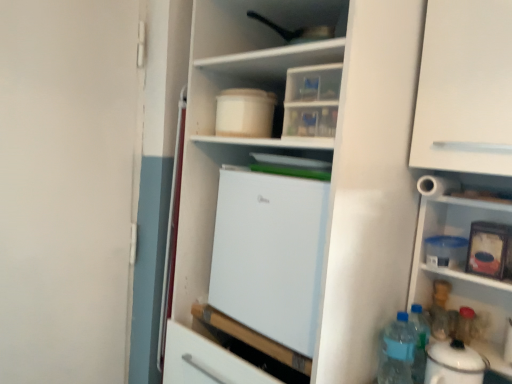
Question: Would you say white glossy electric kettle at lower right contains white matte cabinet at upper right?

Choices:
 (A) no
 (B) yes

Answer: (A)

Question: From a real-world perspective, is white glossy electric kettle at lower right under white matte cabinet at upper right?

Choices:
 (A) no
 (B) yes

Answer: (B)

Question: Is white glossy electric kettle at lower right not near white matte cabinet at upper right?

Choices:
 (A) yes
 (B) no

Answer: (B)

Question: Can you confirm if white glossy electric kettle at lower right is wider than white matte cabinet at upper right?

Choices:
 (A) yes
 (B) no

Answer: (B)

Question: Is white glossy electric kettle at lower right in front of white matte cabinet at upper right?

Choices:
 (A) yes
 (B) no

Answer: (B)

Question: Relative to blue plastic bottle at lower right, the first bottle viewed from the back, is white glossy electric kettle at lower right in front or behind?

Choices:
 (A) behind
 (B) front

Answer: (B)

Question: From their relative heights in the image, would you say white glossy electric kettle at lower right is taller or shorter than blue plastic bottle at lower right, the first bottle viewed from the back?

Choices:
 (A) tall
 (B) short

Answer: (A)

Question: From the image's perspective, is white glossy electric kettle at lower right located above or below blue plastic bottle at lower right, the second bottle when ordered from left to right?

Choices:
 (A) above
 (B) below

Answer: (B)

Question: From a real-world perspective, is white glossy electric kettle at lower right physically located above or below blue plastic bottle at lower right, which is the 2th bottle from right to left?

Choices:
 (A) above
 (B) below

Answer: (B)

Question: Is white matte refrigerator at center inside or outside of blue plastic bottle at lower right, which is the 2th bottle from right to left?

Choices:
 (A) outside
 (B) inside

Answer: (A)

Question: From a real-world perspective, is white matte refrigerator at center physically located above or below blue plastic bottle at lower right, the first bottle viewed from the back?

Choices:
 (A) below
 (B) above

Answer: (B)

Question: Looking at their shapes, would you say white matte refrigerator at center is wider or thinner than blue plastic bottle at lower right, the first bottle viewed from the back?

Choices:
 (A) wide
 (B) thin

Answer: (A)

Question: In the image, is white matte refrigerator at center positioned in front of or behind blue plastic bottle at lower right, the first bottle viewed from the back?

Choices:
 (A) front
 (B) behind

Answer: (A)

Question: Considering the positions of white matte refrigerator at center and translucent plastic bottles at lower right, the first bottle viewed from the left, in the image, is white matte refrigerator at center taller or shorter than translucent plastic bottles at lower right, the first bottle viewed from the left,?

Choices:
 (A) short
 (B) tall

Answer: (B)

Question: Does point (303, 193) appear closer or farther from the camera than point (386, 337)?

Choices:
 (A) farther
 (B) closer

Answer: (B)